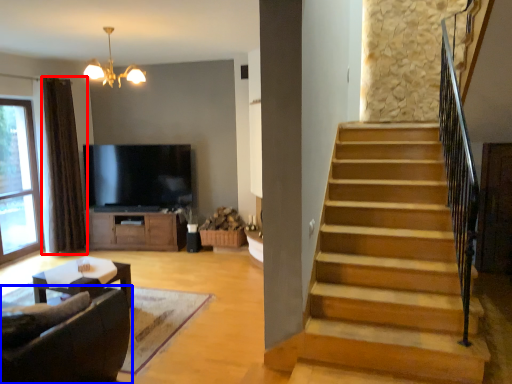
Question: Which of the following is the farthest to the observer, curtain (highlighted by a red box) or studio couch (highlighted by a blue box)?

Choices:
 (A) curtain
 (B) studio couch

Answer: (A)